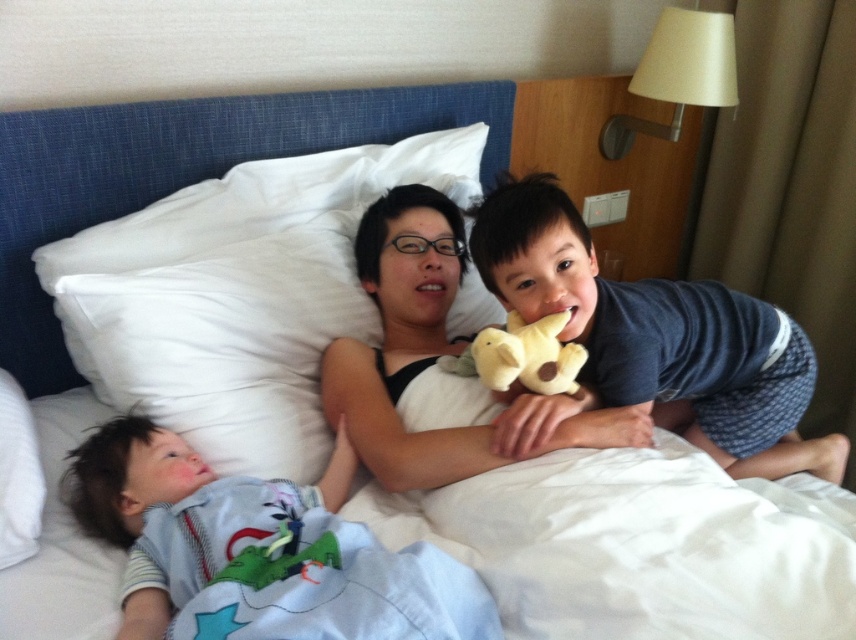
Which of these two, dark blue cotton shirt at upper right or soft yellow plush at center, stands taller?

Standing taller between the two is dark blue cotton shirt at upper right.

Does dark blue cotton shirt at upper right have a smaller size compared to soft yellow plush at center?

No.

Measure the distance between point (794, 432) and camera.

A distance of 1.42 meters exists between point (794, 432) and camera.

Find the location of a particular element. Image resolution: width=856 pixels, height=640 pixels. dark blue cotton shirt at upper right is located at coordinates (651, 342).

Is white soft pillow at upper center further to camera compared to dark blue cotton shirt at upper right?

Yes, white soft pillow at upper center is behind dark blue cotton shirt at upper right.

Looking at this image, which of these two, white soft pillow at upper center or dark blue cotton shirt at upper right, stands taller?

white soft pillow at upper center is taller.

You are a GUI agent. You are given a task and a screenshot of the screen. Output one action in this format:
    pyautogui.click(x=<x>, y=<y>)
    Task: Click on the white soft pillow at upper center
    This screenshot has height=640, width=856.
    Given the screenshot: What is the action you would take?
    241,296

At what (x,y) coordinates should I click in order to perform the action: click on white soft pillow at upper center. Please return your answer as a coordinate pair (x, y). The image size is (856, 640). Looking at the image, I should click on (241, 296).

Is light blue cotton shirt at lower left taller than dark blue cotton shirt at upper right?

Incorrect, light blue cotton shirt at lower left's height is not larger of dark blue cotton shirt at upper right's.

Is light blue cotton shirt at lower left positioned in front of dark blue cotton shirt at upper right?

That is True.

This screenshot has width=856, height=640. Describe the element at coordinates (259, 550) in the screenshot. I see `light blue cotton shirt at lower left` at that location.

The image size is (856, 640). Find the location of `light blue cotton shirt at lower left`. light blue cotton shirt at lower left is located at coordinates (259, 550).